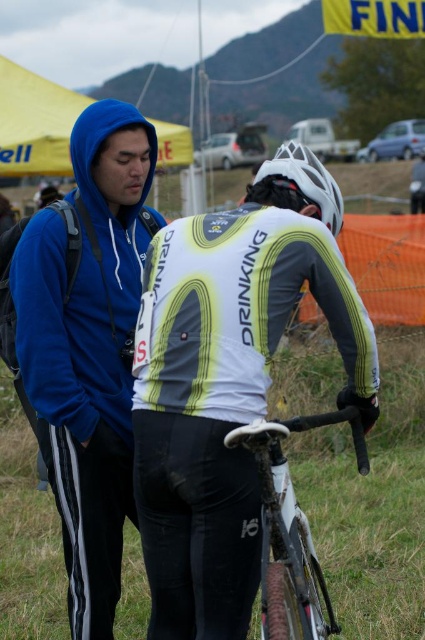
How distant is blue fleece jacket at left from white matte bicycle helmet at center?

blue fleece jacket at left is 1.23 meters from white matte bicycle helmet at center.

Between blue fleece jacket at left and white matte bicycle helmet at center, which one is positioned higher?

white matte bicycle helmet at center

The image size is (425, 640). In order to click on blue fleece jacket at left in this screenshot , I will do `click(85, 342)`.

Locate an element on the screen. blue fleece jacket at left is located at coordinates (85, 342).

Between white matte bicycle at center and white matte bicycle handlebars at center, which one appears on the left side from the viewer's perspective?

white matte bicycle at center

This screenshot has width=425, height=640. What are the coordinates of `white matte bicycle at center` in the screenshot? It's located at (229, 381).

This screenshot has height=640, width=425. What are the coordinates of `white matte bicycle at center` in the screenshot? It's located at (229, 381).

Which is in front, point (302, 609) or point (308, 189)?

Positioned in front is point (302, 609).

Is white matte bicycle handlebars at center behind white matte bicycle helmet at center?

No, white matte bicycle handlebars at center is closer to the viewer.

Which is behind, point (354, 445) or point (297, 173)?

The point (354, 445) is behind.

Find the location of a particular element. This screenshot has width=425, height=640. white matte bicycle handlebars at center is located at coordinates (291, 529).